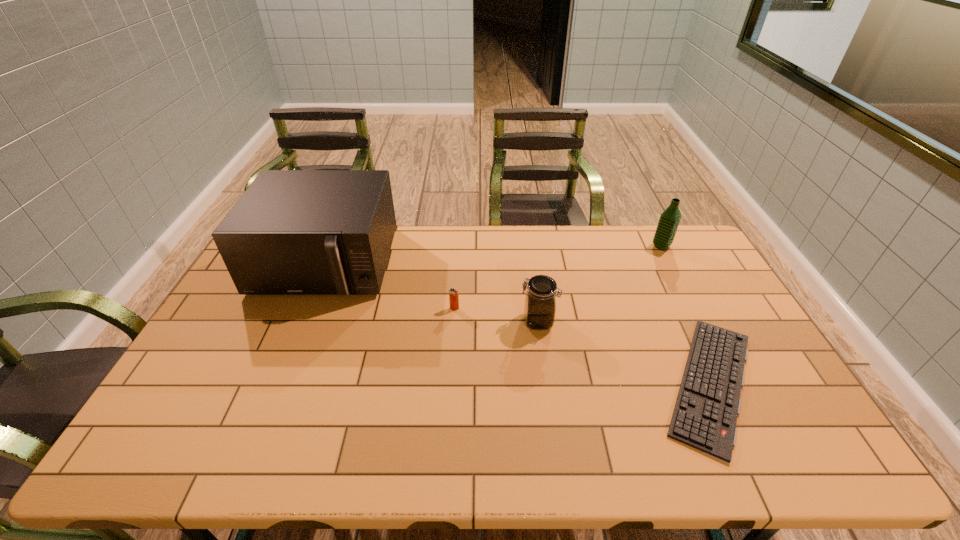
The image size is (960, 540). I want to click on vacant space in between the computer keyboard and the igniter, so click(583, 346).

Image resolution: width=960 pixels, height=540 pixels. In order to click on empty space between the water bottle and the jar in this screenshot , I will do `click(600, 284)`.

Where is `blank region between the third nearest object and the water bottle`? This screenshot has width=960, height=540. blank region between the third nearest object and the water bottle is located at coordinates (558, 277).

Locate an element on the screen. vacant space in between the water bottle and the shortest object is located at coordinates (686, 315).

Find the location of a particular element. The height and width of the screenshot is (540, 960). vacant area that lies between the leftmost object and the water bottle is located at coordinates [493, 255].

This screenshot has width=960, height=540. Find the location of `free space between the tallest object and the computer keyboard`. free space between the tallest object and the computer keyboard is located at coordinates (518, 323).

This screenshot has width=960, height=540. What are the coordinates of `free space that is in between the computer keyboard and the fourth object from right to left` in the screenshot? It's located at (583, 346).

I want to click on free spot between the fourth shortest object and the microwave oven, so click(x=493, y=255).

Find the location of `free area in between the leftmost object and the fourth shortest object`. free area in between the leftmost object and the fourth shortest object is located at coordinates (493, 255).

Locate an element on the screen. This screenshot has height=540, width=960. object that is the second closest to the computer keyboard is located at coordinates (669, 220).